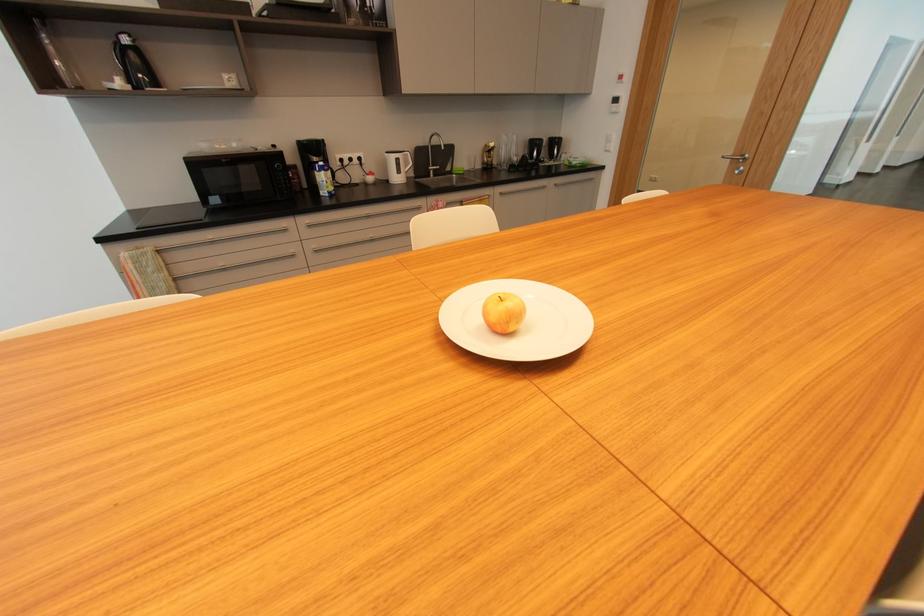
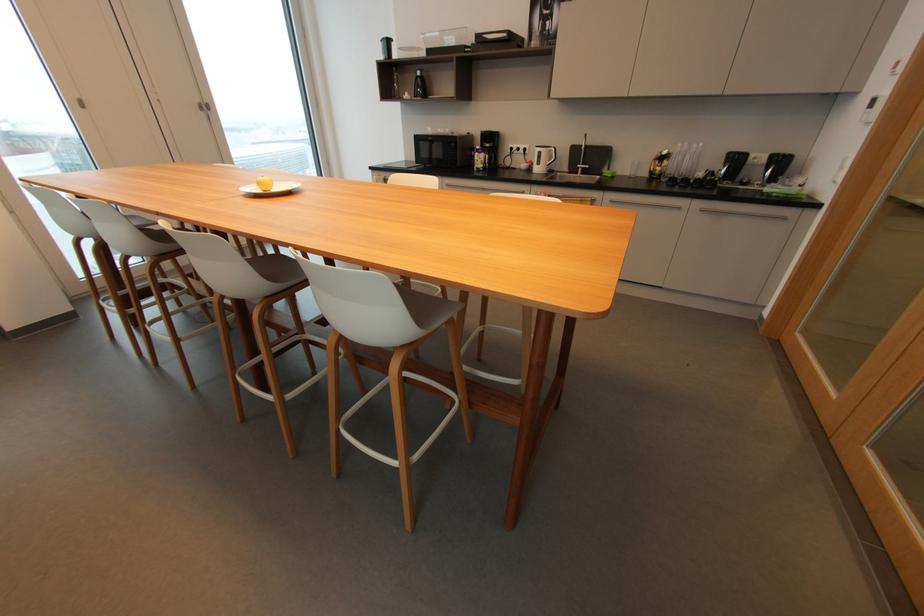
Find the pixel in the second image that matches pixel 128 41 in the first image.

(421, 74)